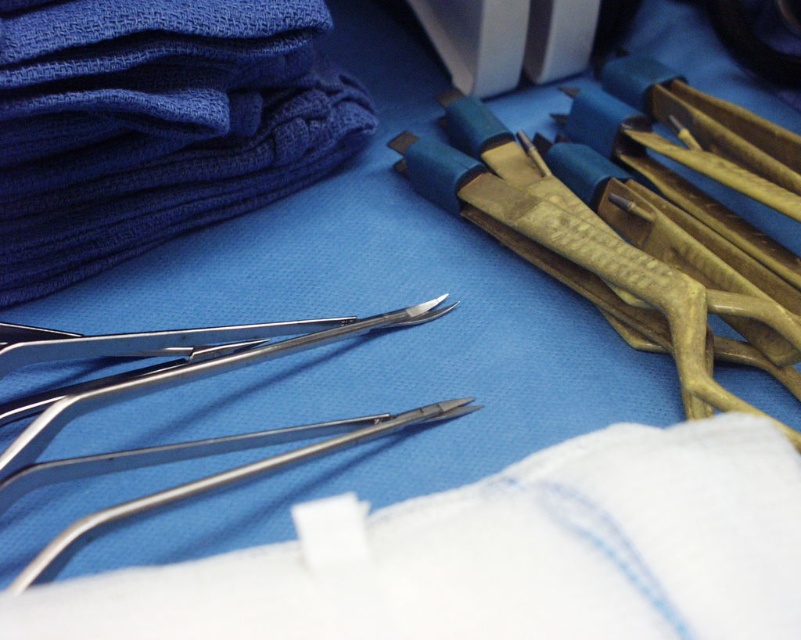
Question: Which object is closer to the camera taking this photo?

Choices:
 (A) polished metal forceps at center
 (B) white fabric at center
 (C) gold textured forceps at upper right

Answer: (B)

Question: Which of the following is the farthest from the observer?

Choices:
 (A) (368, 428)
 (B) (647, 314)
 (C) (135, 4)
 (D) (735, 554)

Answer: (B)

Question: Does white fabric at center have a smaller size compared to blue fabric at upper left?

Choices:
 (A) yes
 (B) no

Answer: (A)

Question: Does white fabric at center have a smaller size compared to gold textured forceps at upper right?

Choices:
 (A) no
 (B) yes

Answer: (B)

Question: Which point is farther to the camera?

Choices:
 (A) gold textured forceps at upper right
 (B) white fabric at center
 (C) blue fabric at upper left

Answer: (C)

Question: Where is white fabric at center located in relation to gold textured forceps at upper right in the image?

Choices:
 (A) below
 (B) above

Answer: (A)